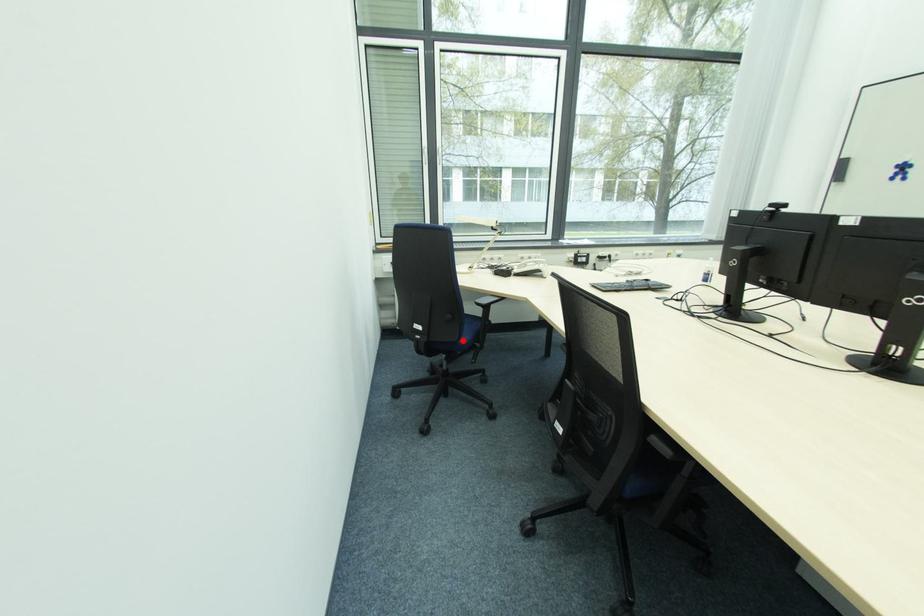
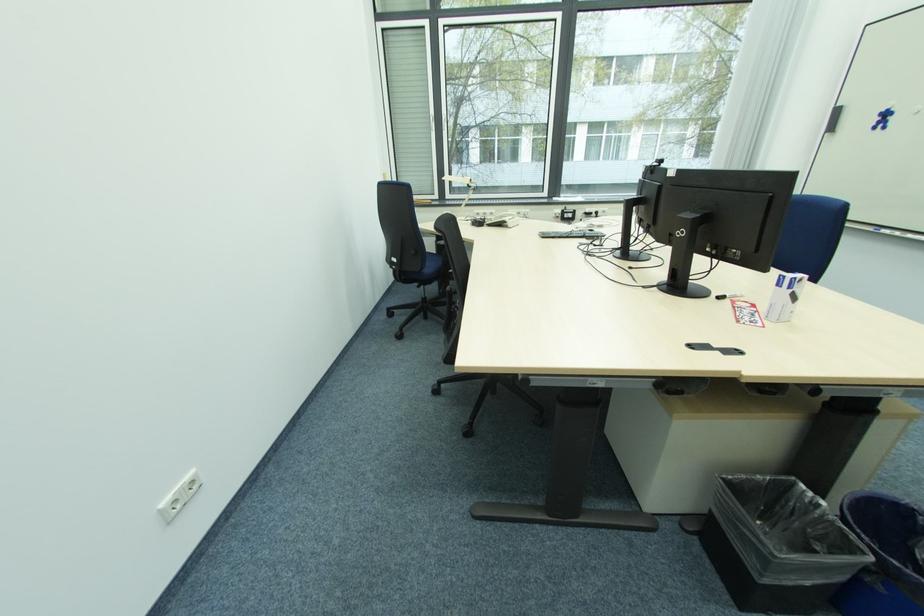
Question: I am providing you with two images of the same scene from different viewpoints. Image1 has a red point marked. In image2, the corresponding 3D location appears at what relative position? Reply with the corresponding letter.

Choices:
 (A) Closer
 (B) Farther

Answer: (A)